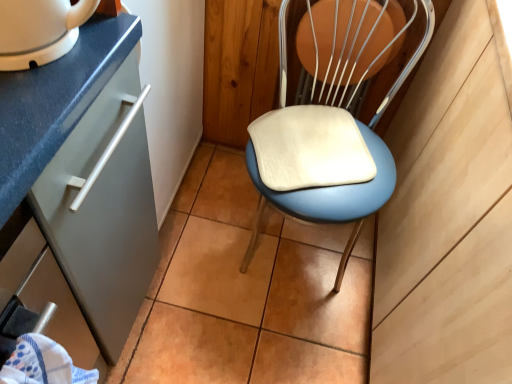
Question: Relative to white glossy mug at upper left, is blue fabric towel at lower left in front or behind?

Choices:
 (A) front
 (B) behind

Answer: (A)

Question: Is blue fabric towel at lower left taller or shorter than white glossy mug at upper left?

Choices:
 (A) tall
 (B) short

Answer: (A)

Question: Estimate the real-world distances between objects in this image. Which object is farther from the blue fabric towel at lower left?

Choices:
 (A) blue padded chair at center
 (B) white glossy mug at upper left

Answer: (A)

Question: Which object is the farthest from the blue fabric towel at lower left?

Choices:
 (A) blue padded chair at center
 (B) white glossy mug at upper left

Answer: (A)